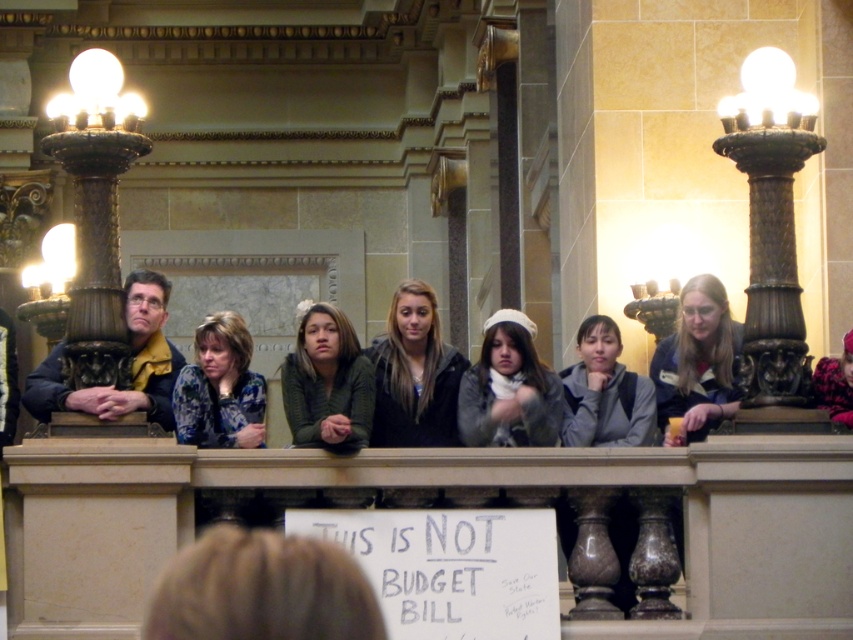
The image size is (853, 640). Describe the element at coordinates (508, 388) in the screenshot. I see `white woolen hat at center` at that location.

This screenshot has width=853, height=640. In order to click on white woolen hat at center in this screenshot , I will do `click(508, 388)`.

The image size is (853, 640). I want to click on white woolen hat at center, so click(508, 388).

Based on the photo, can you confirm if blonde hair at lower center is positioned below fluffy pink coat at center?

Yes.

Between point (209, 634) and point (851, 424), which one is positioned in front?

Point (209, 634) is more forward.

Between point (256, 556) and point (817, 378), which one is positioned behind?

The point (817, 378) is behind.

Where is `blonde hair at lower center`? The width and height of the screenshot is (853, 640). blonde hair at lower center is located at coordinates (260, 589).

Can you confirm if matte blue shirt at center is taller than metallic gold lamp at left?

No.

Who is more forward, (666, 392) or (33, 304)?

Result: Point (666, 392) is in front.

Locate an element on the screen. The height and width of the screenshot is (640, 853). matte blue shirt at center is located at coordinates (698, 362).